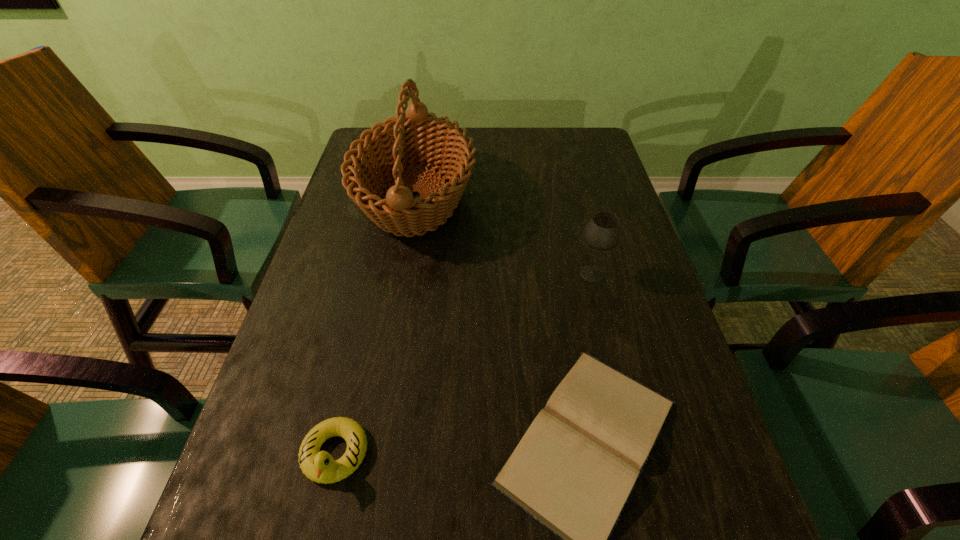
At what (x,y) coordinates should I click in order to perform the action: click on object situated at the right edge. Please return your answer as a coordinate pair (x, y). The image size is (960, 540). Looking at the image, I should click on (603, 231).

At what (x,y) coordinates should I click in order to perform the action: click on object that is at the far left corner. Please return your answer as a coordinate pair (x, y). The height and width of the screenshot is (540, 960). Looking at the image, I should click on (398, 143).

The width and height of the screenshot is (960, 540). In the image, there is a desktop. Find the location of `vacant region at the far edge`. vacant region at the far edge is located at coordinates (525, 164).

Find the location of a particular element. This screenshot has height=540, width=960. free space at the left edge of the desktop is located at coordinates (380, 240).

The height and width of the screenshot is (540, 960). In order to click on free space at the right edge of the desktop in this screenshot , I will do `click(581, 180)`.

Identify the location of vacant area at the far right corner. The width and height of the screenshot is (960, 540). (567, 138).

This screenshot has height=540, width=960. I want to click on vacant area that lies between the duckling and the basket, so click(375, 327).

Locate an element on the screen. Image resolution: width=960 pixels, height=540 pixels. free space between the duckling and the second farthest object is located at coordinates (464, 364).

Where is `free space between the third shortest object and the tallest object`? free space between the third shortest object and the tallest object is located at coordinates (504, 236).

You are a GUI agent. You are given a task and a screenshot of the screen. Output one action in this format:
    pyautogui.click(x=<x>, y=<y>)
    Task: Click on the empty location between the basket and the second shortest object
    The height and width of the screenshot is (540, 960).
    Given the screenshot: What is the action you would take?
    pyautogui.click(x=375, y=327)